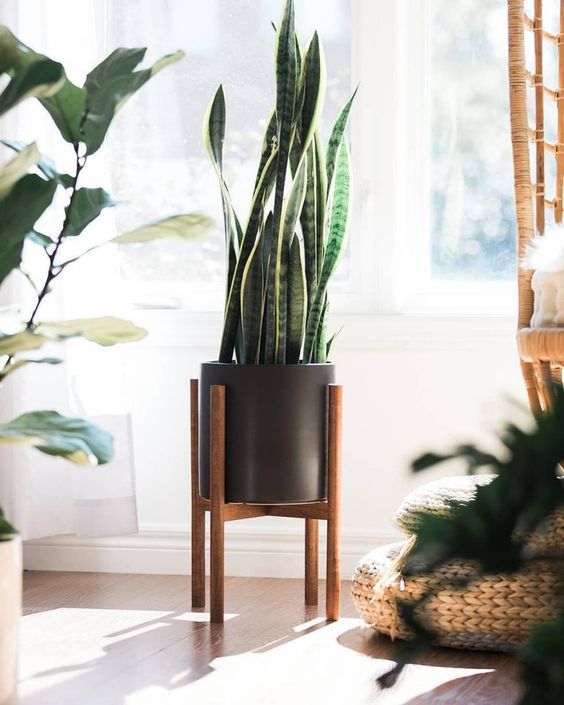
I want to click on 4 brown legs to flower pot, so click(x=222, y=603), click(x=189, y=594), click(x=311, y=572), click(x=334, y=610).